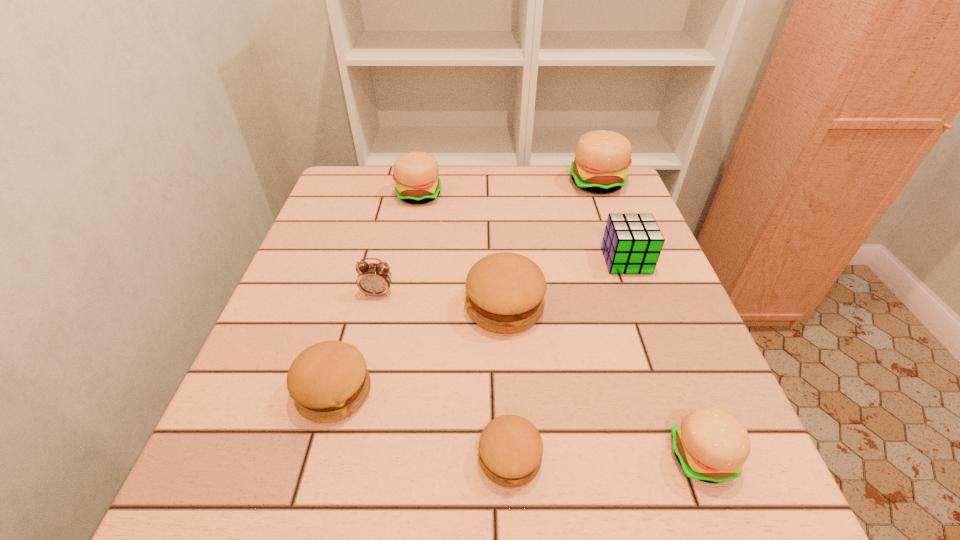
The height and width of the screenshot is (540, 960). I want to click on vacant space at the far right corner of the desktop, so click(x=575, y=200).

Locate an element on the screen. vacant area between the alarm clock and the nearest beige hamburger is located at coordinates (540, 375).

This screenshot has height=540, width=960. What are the coordinates of `free space between the third nearest object and the sixth nearest object` in the screenshot? It's located at (480, 326).

Locate an element on the screen. vacant space in between the alarm clock and the second biggest brown hamburger is located at coordinates (356, 342).

The height and width of the screenshot is (540, 960). I want to click on vacant space that is in between the farthest brown hamburger and the second farthest brown hamburger, so click(x=420, y=349).

Find the location of `empty space that is in between the third nearest hamburger and the alarm clock`. empty space that is in between the third nearest hamburger and the alarm clock is located at coordinates (356, 342).

Find the location of a particular element. free space between the biggest brown hamburger and the second nearest brown hamburger is located at coordinates (420, 349).

The width and height of the screenshot is (960, 540). Find the location of `object that ranks as the fourth closest to the leftmost brown hamburger`. object that ranks as the fourth closest to the leftmost brown hamburger is located at coordinates (711, 445).

I want to click on the fourth closest object to the sixth nearest object, so click(x=510, y=450).

Where is `the closest hamburger to the alarm clock`? the closest hamburger to the alarm clock is located at coordinates (505, 291).